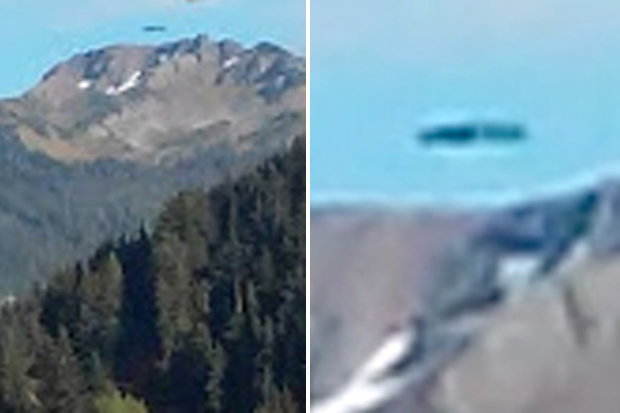
Locate an element on the screen. basin is located at coordinates (193, 108).